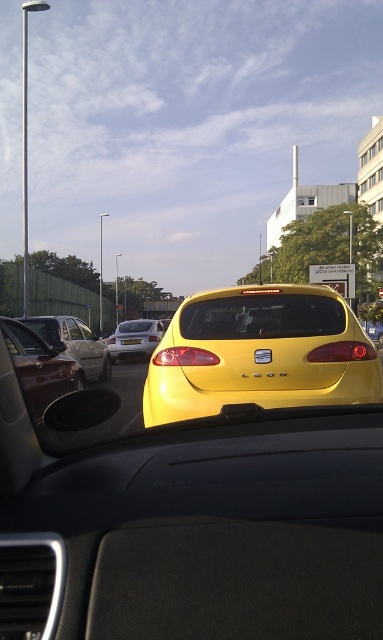
You are driving a car and see the yellow matte hatchback at center and the silver metallic sedan at center ahead. Which one is closer to you?

The yellow matte hatchback at center is closer because it is positioned in front of the silver metallic sedan at center.

You are driving and need to change lanes to the right. There is a silver metallic sedan at center in your blind spot. Can you safely move into that lane without checking your blind spot?

No, you cannot safely move into the lane without checking your blind spot because the silver metallic sedan at center is located in your blind spot area at coordinates [134,339].